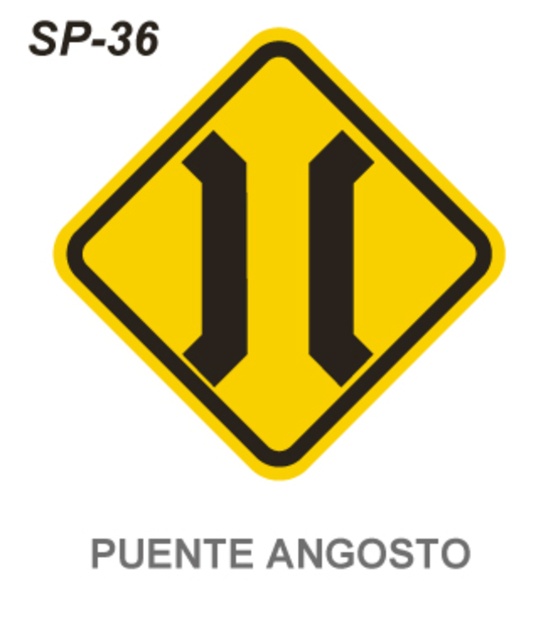
What do you see at coordinates (277, 253) in the screenshot? I see `yellow matte road sign at center` at bounding box center [277, 253].

Does yellow matte road sign at center have a lesser height compared to black text at upper left?

In fact, yellow matte road sign at center may be taller than black text at upper left.

Does point (143, 310) lie in front of point (41, 36)?

No.

You are a GUI agent. You are given a task and a screenshot of the screen. Output one action in this format:
    pyautogui.click(x=<x>, y=<y>)
    Task: Click on the yellow matte road sign at center
    The image size is (558, 640).
    Given the screenshot: What is the action you would take?
    pyautogui.click(x=277, y=253)